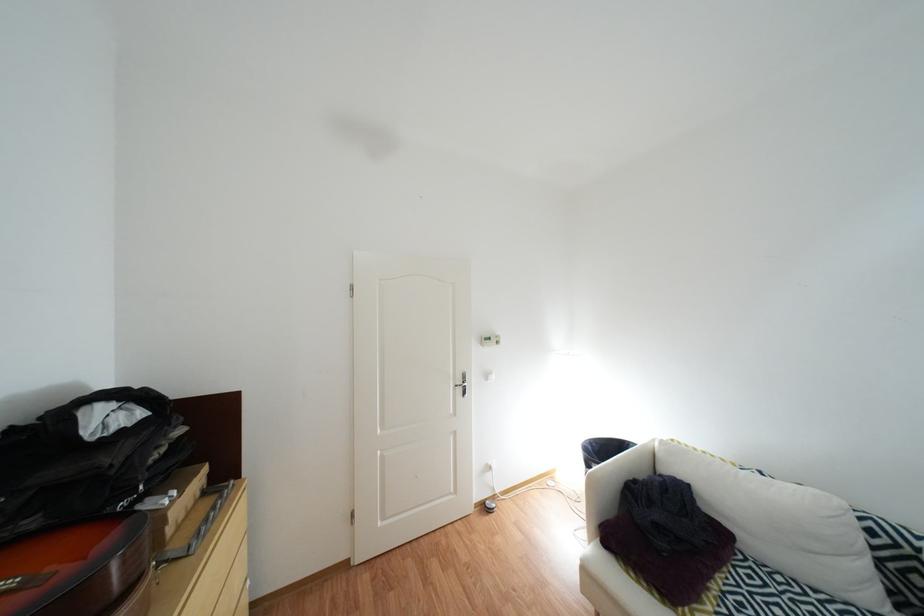
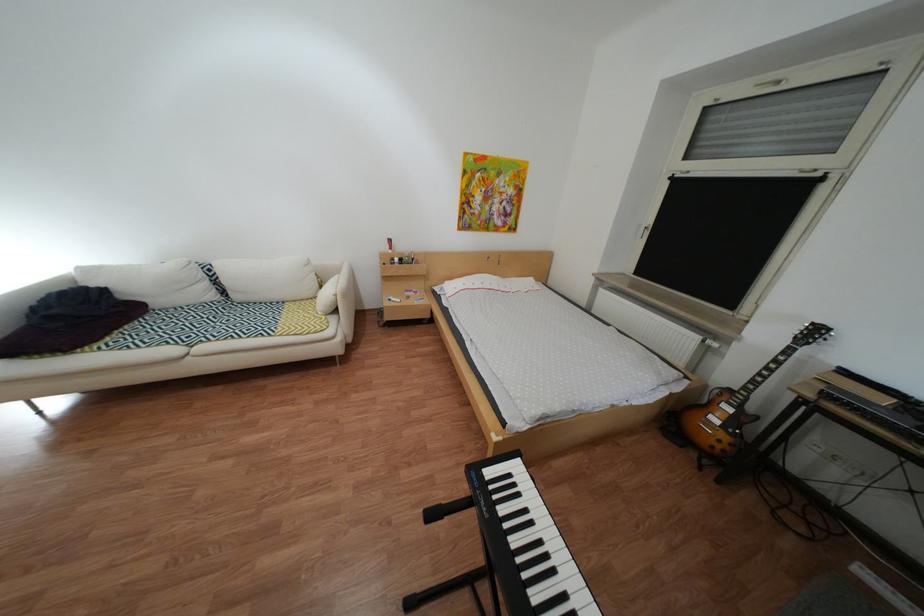
Find the pixel in the second image that matches (766,546) in the first image.

(172, 304)